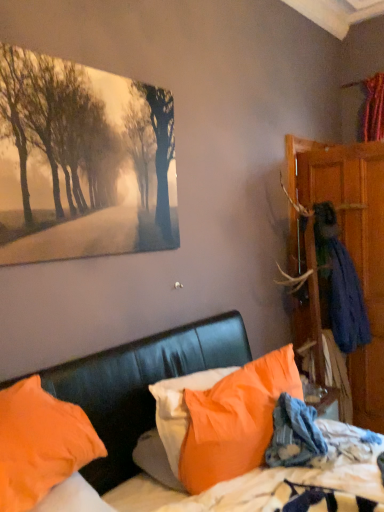
Question: Should I look upward or downward to see orange fabric pillow at lower left, the 3th pillow viewed from the right?

Choices:
 (A) up
 (B) down

Answer: (B)

Question: Is orange fabric pillow at lower left, placed as the first pillow when sorted from left to right, in front of orange fabric pillow at center, which ranks as the 3th pillow in left-to-right order?

Choices:
 (A) yes
 (B) no

Answer: (A)

Question: Is orange fabric pillow at lower left, the 3th pillow viewed from the right, positioned beyond the bounds of orange fabric pillow at center, positioned as the 1th pillow in right-to-left order?

Choices:
 (A) no
 (B) yes

Answer: (B)

Question: Does orange fabric pillow at lower left, placed as the first pillow when sorted from left to right, turn towards orange fabric pillow at center, positioned as the 1th pillow in right-to-left order?

Choices:
 (A) yes
 (B) no

Answer: (B)

Question: Is orange fabric pillow at lower left, placed as the first pillow when sorted from left to right, far away from orange fabric pillow at center, which ranks as the 3th pillow in left-to-right order?

Choices:
 (A) no
 (B) yes

Answer: (A)

Question: From a real-world perspective, is orange fabric pillow at lower left, placed as the first pillow when sorted from left to right, positioned over orange fabric pillow at center, which ranks as the 3th pillow in left-to-right order, based on gravity?

Choices:
 (A) no
 (B) yes

Answer: (B)

Question: Considering the relative sizes of orange fabric pillow at lower left, the 3th pillow viewed from the right, and orange fabric pillow at center, positioned as the 1th pillow in right-to-left order, in the image provided, is orange fabric pillow at lower left, the 3th pillow viewed from the right, wider than orange fabric pillow at center, positioned as the 1th pillow in right-to-left order,?

Choices:
 (A) no
 (B) yes

Answer: (B)

Question: Is orange fabric pillow at center, positioned as the 1th pillow in right-to-left order, shorter than matte canvas painting at upper left?

Choices:
 (A) yes
 (B) no

Answer: (A)

Question: Can you confirm if orange fabric pillow at center, which ranks as the 3th pillow in left-to-right order, is wider than matte canvas painting at upper left?

Choices:
 (A) yes
 (B) no

Answer: (A)

Question: Considering the relative positions of orange fabric pillow at center, positioned as the 1th pillow in right-to-left order, and matte canvas painting at upper left in the image provided, is orange fabric pillow at center, positioned as the 1th pillow in right-to-left order, to the right of matte canvas painting at upper left from the viewer's perspective?

Choices:
 (A) yes
 (B) no

Answer: (A)

Question: From a real-world perspective, is orange fabric pillow at center, which ranks as the 3th pillow in left-to-right order, under matte canvas painting at upper left?

Choices:
 (A) no
 (B) yes

Answer: (B)

Question: Is orange fabric pillow at center, positioned as the 1th pillow in right-to-left order, to the left of matte canvas painting at upper left from the viewer's perspective?

Choices:
 (A) no
 (B) yes

Answer: (A)

Question: From the image's perspective, does orange fabric pillow at center, positioned as the 1th pillow in right-to-left order, appear lower than matte canvas painting at upper left?

Choices:
 (A) no
 (B) yes

Answer: (B)

Question: From a real-world perspective, is blue fabric coat at right on top of matte canvas painting at upper left?

Choices:
 (A) no
 (B) yes

Answer: (A)